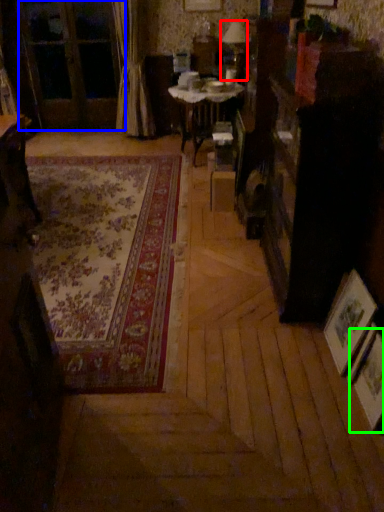
Question: Which object is the farthest from table lamp (highlighted by a red box)? Choose among these: screen door (highlighted by a blue box) or picture frame (highlighted by a green box).

Choices:
 (A) screen door
 (B) picture frame

Answer: (B)